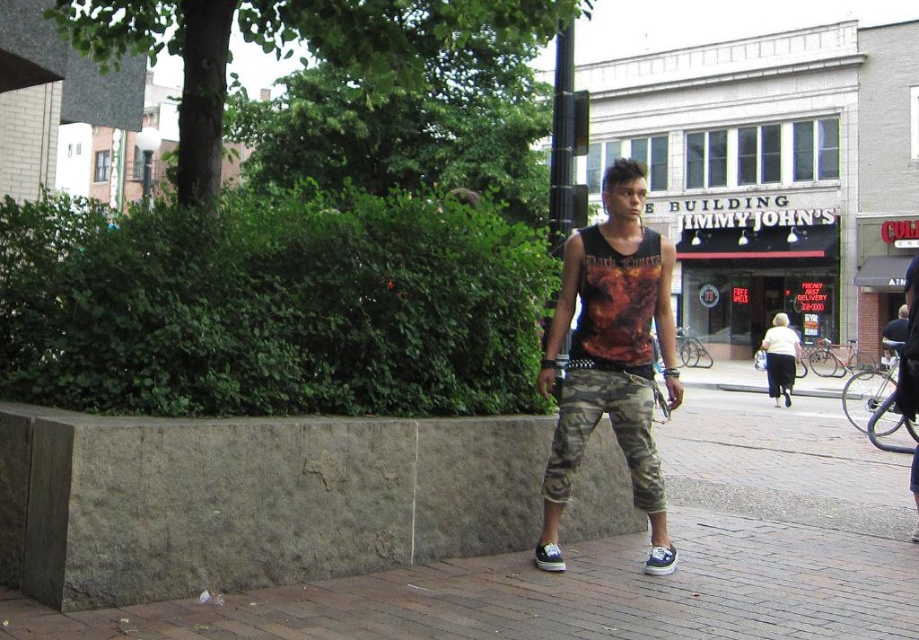
Looking at this image, does gray concrete pavement at center appear over printed fabric tank top at center?

Actually, gray concrete pavement at center is below printed fabric tank top at center.

Between gray concrete pavement at center and printed fabric tank top at center, which one has less height?

With less height is printed fabric tank top at center.

Is point (390, 586) closer to camera compared to point (600, 241)?

That is True.

This screenshot has width=919, height=640. Identify the location of gray concrete pavement at center. (623, 557).